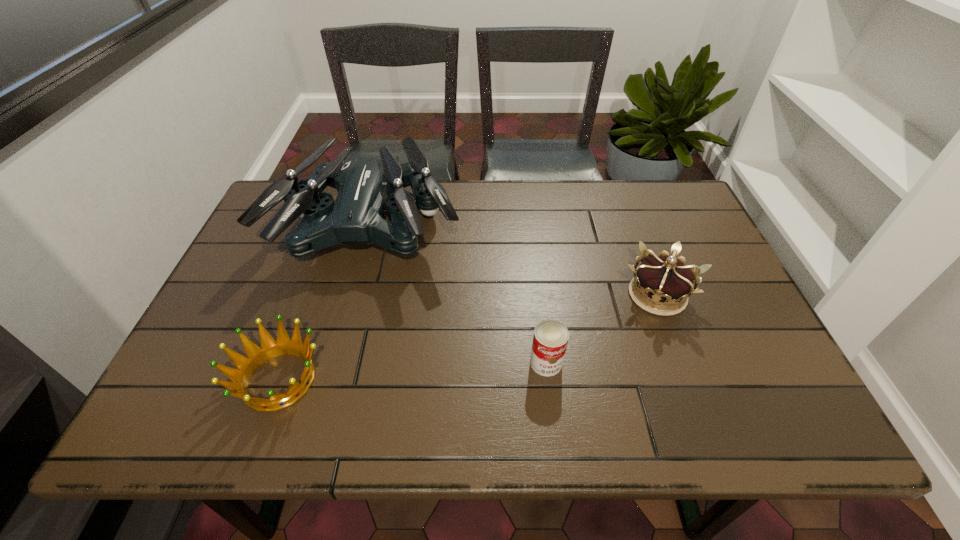
You are a GUI agent. You are given a task and a screenshot of the screen. Output one action in this format:
    pyautogui.click(x=<x>, y=<y>)
    Task: Click on the tallest object
    The image size is (960, 540).
    Given the screenshot: What is the action you would take?
    pyautogui.click(x=365, y=182)

Locate an element on the screen. The height and width of the screenshot is (540, 960). the taller crown is located at coordinates (663, 280).

The width and height of the screenshot is (960, 540). Identify the location of the farther crown. (663, 280).

The image size is (960, 540). What are the coordinates of `the third object from left to right` in the screenshot? It's located at (550, 339).

You are a GUI agent. You are given a task and a screenshot of the screen. Output one action in this format:
    pyautogui.click(x=<x>, y=<y>)
    Task: Click on the shorter crown
    Image resolution: width=960 pixels, height=540 pixels.
    Given the screenshot: What is the action you would take?
    pyautogui.click(x=256, y=356)

This screenshot has width=960, height=540. I want to click on the nearer crown, so click(256, 356).

Locate an element on the screen. This screenshot has width=960, height=540. blank space located 0.180m on the right of the drone is located at coordinates (524, 227).

The width and height of the screenshot is (960, 540). Identify the location of vacant space located on the back of the rightmost object. (616, 186).

I want to click on vacant region located 0.050m on the front label of the third object from left to right, so click(x=550, y=398).

At what (x,y) coordinates should I click in order to perform the action: click on vacant position located on the back of the left crown. Please return your answer as a coordinate pair (x, y). This screenshot has height=540, width=960. Looking at the image, I should click on (319, 270).